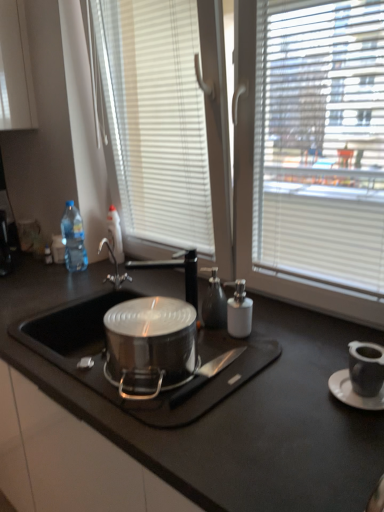
Locate an element on the screen. free space behind white ceramic saucer at lower right is located at coordinates (319, 353).